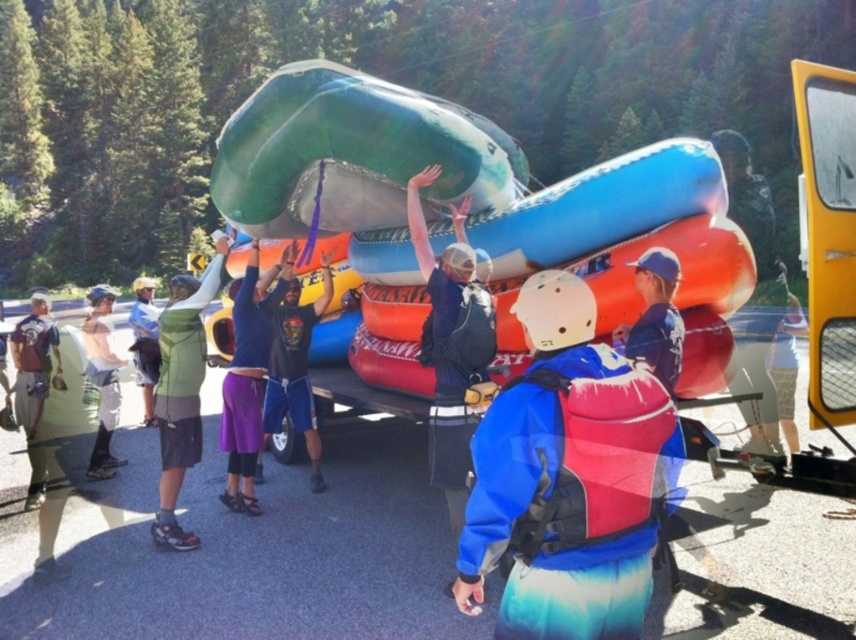
Who is taller, blue matte life jacket at center or green matte raft at center?

Standing taller between the two is green matte raft at center.

Is point (651, 284) behind point (143, 426)?

No, it is in front of (143, 426).

At what (x,y) coordinates should I click in order to perform the action: click on blue matte life jacket at center. Please return your answer as a coordinate pair (x, y). The height and width of the screenshot is (640, 856). Looking at the image, I should click on (655, 317).

Is matte black backpack at center further to the viewer compared to green matte shirt at center?

No, matte black backpack at center is closer to the viewer.

Which is below, matte black backpack at center or green matte shirt at center?

green matte shirt at center is below.

Between point (413, 204) and point (105, 458), which one is positioned in front?

Point (413, 204) is in front.

This screenshot has height=640, width=856. Identify the location of matte black backpack at center. (450, 344).

Is the position of purple fabric pants at lower right less distant than that of green matte raft at center?

Yes, it is in front of green matte raft at center.

Can you confirm if purple fabric pants at lower right is shorter than green matte raft at center?

Yes, purple fabric pants at lower right is shorter than green matte raft at center.

Which is behind, point (789, 396) or point (140, 355)?

Point (140, 355)

Locate an element on the screen. The image size is (856, 640). purple fabric pants at lower right is located at coordinates (786, 365).